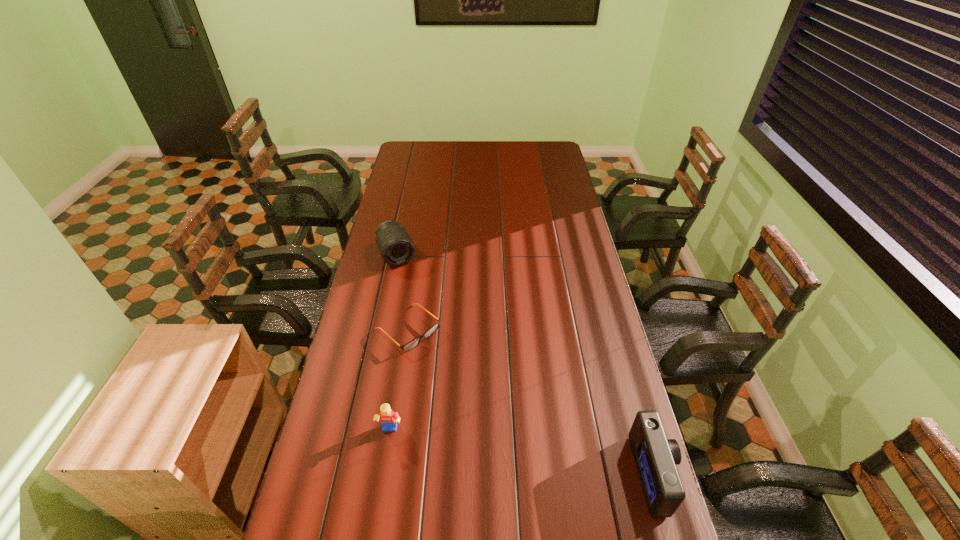
Locate an element on the screen. The height and width of the screenshot is (540, 960). free spot on the desktop that is between the third tallest object and the rightmost object and is positioned on the surface of the farthest object is located at coordinates (492, 448).

The width and height of the screenshot is (960, 540). What are the coordinates of `vacant space on the desktop that is between the third tallest object and the camera and is positioned on the front-facing side of the third nearest object` in the screenshot? It's located at (549, 457).